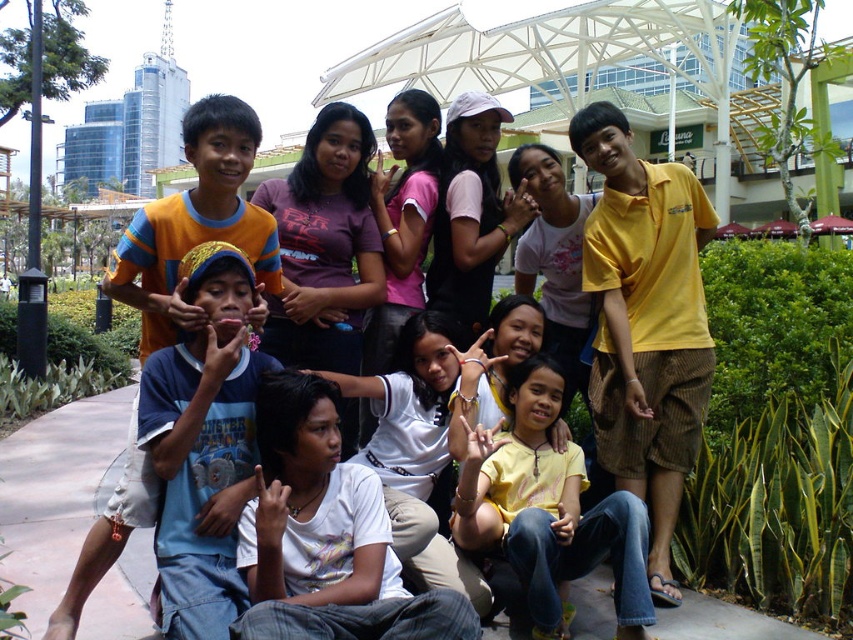
Who is positioned more to the right, yellow cotton polo shirt at center or blue cotton shirt at center?

Positioned to the right is yellow cotton polo shirt at center.

Does yellow cotton polo shirt at center have a lesser width compared to blue cotton shirt at center?

Indeed, yellow cotton polo shirt at center has a lesser width compared to blue cotton shirt at center.

Between point (695, 355) and point (227, 305), which one is positioned behind?

Positioned behind is point (695, 355).

Where is `yellow cotton polo shirt at center`? This screenshot has height=640, width=853. yellow cotton polo shirt at center is located at coordinates (645, 323).

Measure the distance from blue cotton shirt at center to yellow matte shirt at center.

They are 4.90 feet apart.

Which is behind, point (161, 396) or point (543, 628)?

The point (543, 628) is more distant.

Is point (225, 358) more distant than point (579, 550)?

No, (225, 358) is closer to viewer.

Image resolution: width=853 pixels, height=640 pixels. What are the coordinates of `blue cotton shirt at center` in the screenshot? It's located at (202, 444).

Which is more to the right, yellow cotton polo shirt at center or yellow matte shirt at center?

From the viewer's perspective, yellow cotton polo shirt at center appears more on the right side.

What do you see at coordinates (645, 323) in the screenshot? The image size is (853, 640). I see `yellow cotton polo shirt at center` at bounding box center [645, 323].

Where is `yellow cotton polo shirt at center`? yellow cotton polo shirt at center is located at coordinates 645,323.

Locate an element on the screen. The image size is (853, 640). yellow cotton polo shirt at center is located at coordinates (645, 323).